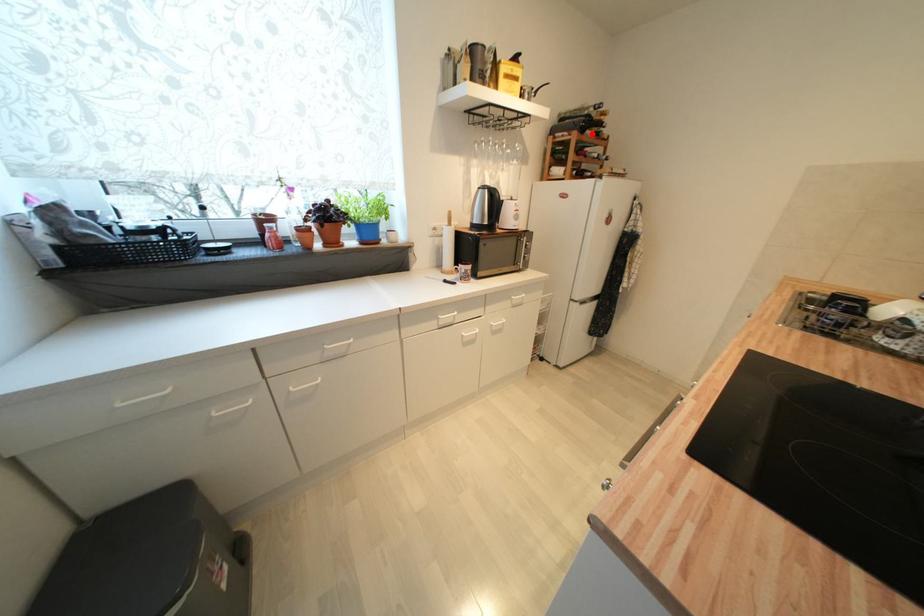
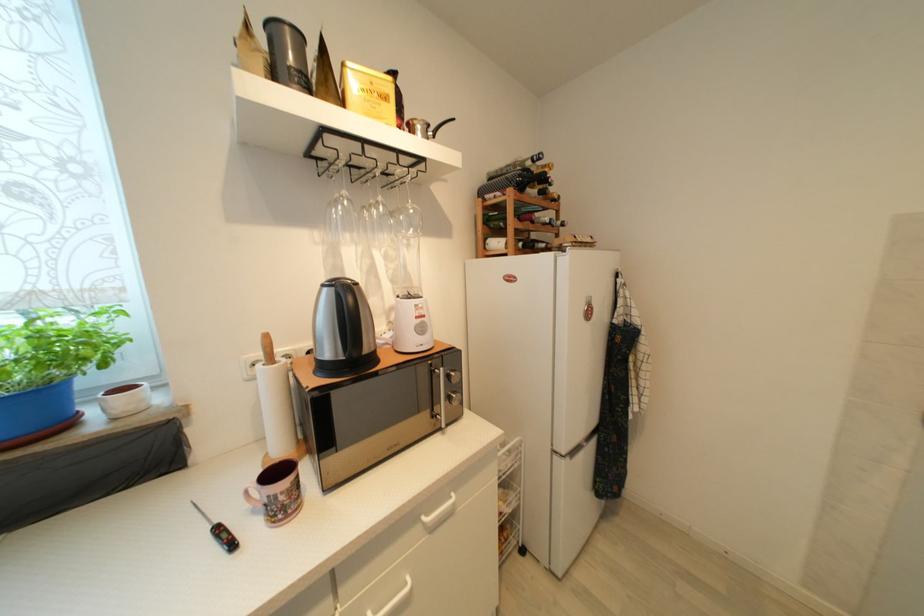
Find the pixel in the second image that matches the highlighted location in the first image.

(533, 192)